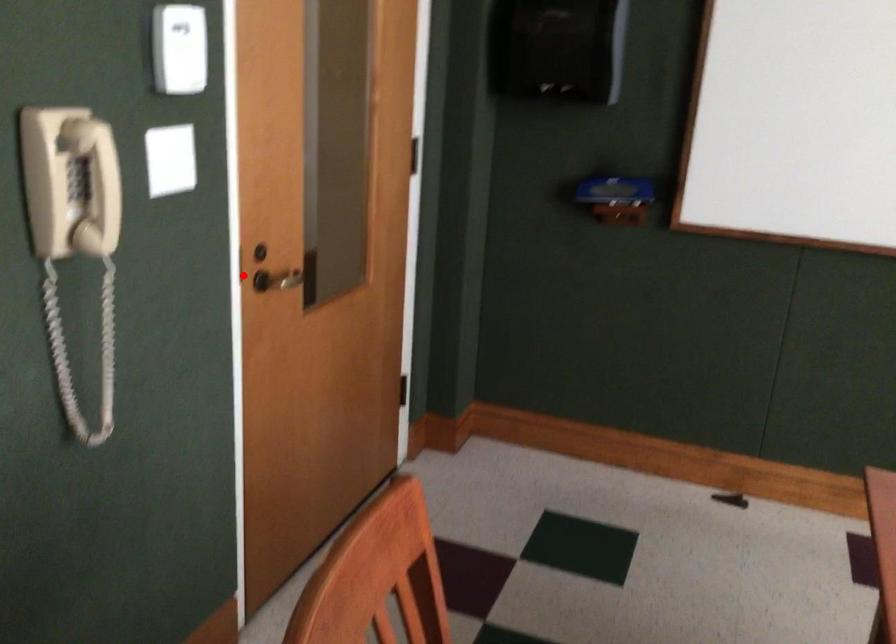
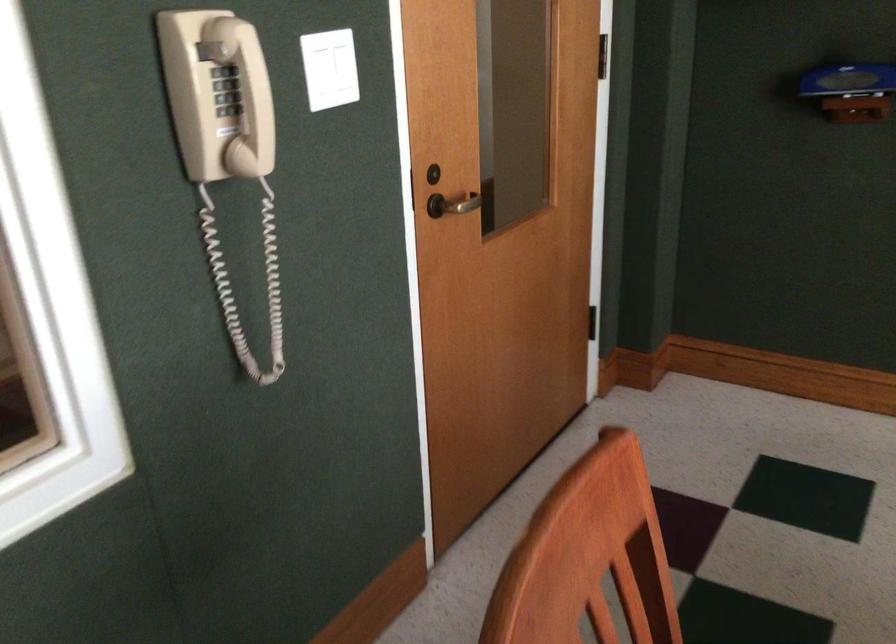
The point at the highlighted location is marked in the first image. Where is the corresponding point in the second image?

(409, 191)